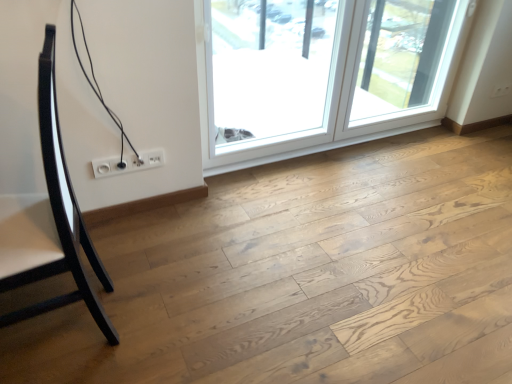
Question: From the image's perspective, would you say natural wood floor at center is positioned over glossy black chair at left?

Choices:
 (A) no
 (B) yes

Answer: (A)

Question: Would you say natural wood floor at center is outside glossy black chair at left?

Choices:
 (A) yes
 (B) no

Answer: (A)

Question: Considering the relative sizes of natural wood floor at center and glossy black chair at left in the image provided, is natural wood floor at center taller than glossy black chair at left?

Choices:
 (A) yes
 (B) no

Answer: (B)

Question: From the image's perspective, is natural wood floor at center located beneath glossy black chair at left?

Choices:
 (A) no
 (B) yes

Answer: (B)

Question: Is natural wood floor at center closer to the viewer compared to glossy black chair at left?

Choices:
 (A) yes
 (B) no

Answer: (B)

Question: From a real-world perspective, relative to natural wood floor at center, is transparent glass window at upper right, the 2th window viewed from the left, vertically above or below?

Choices:
 (A) below
 (B) above

Answer: (B)

Question: Is transparent glass window at upper right, the first window from the right, in front of or behind natural wood floor at center in the image?

Choices:
 (A) behind
 (B) front

Answer: (A)

Question: From the image's perspective, is transparent glass window at upper right, the 2th window viewed from the left, positioned above or below natural wood floor at center?

Choices:
 (A) below
 (B) above

Answer: (B)

Question: Is transparent glass window at upper right, the first window from the right, taller or shorter than natural wood floor at center?

Choices:
 (A) tall
 (B) short

Answer: (A)

Question: Relative to transparent glass window at upper center, positioned as the first window in left-to-right order, is natural wood floor at center in front or behind?

Choices:
 (A) front
 (B) behind

Answer: (A)

Question: Is natural wood floor at center situated inside transparent glass window at upper center, acting as the 2th window starting from the right, or outside?

Choices:
 (A) outside
 (B) inside

Answer: (A)

Question: Is natural wood floor at center wider or thinner than transparent glass window at upper center, positioned as the first window in left-to-right order?

Choices:
 (A) wide
 (B) thin

Answer: (A)

Question: From the image's perspective, is natural wood floor at center positioned above or below transparent glass window at upper center, positioned as the first window in left-to-right order?

Choices:
 (A) above
 (B) below

Answer: (B)

Question: From a real-world perspective, is glossy black chair at left above or below transparent glass screen door at upper right?

Choices:
 (A) below
 (B) above

Answer: (B)

Question: Visually, is glossy black chair at left positioned to the left or to the right of transparent glass screen door at upper right?

Choices:
 (A) left
 (B) right

Answer: (A)